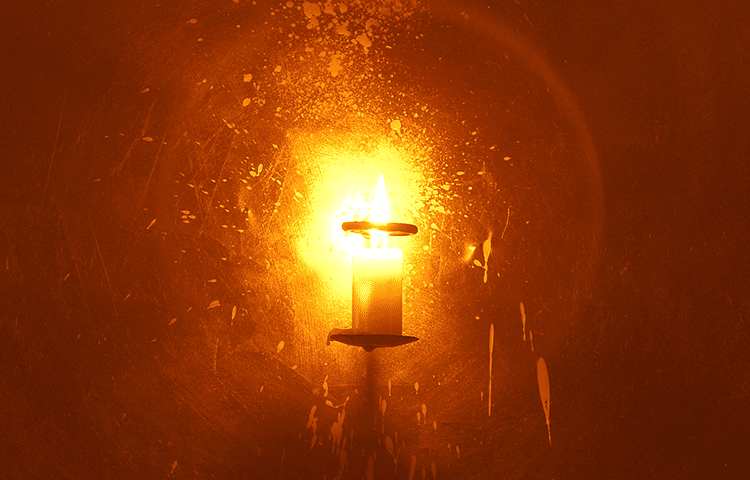
At what (x,y) coordinates should I click in order to perform the action: click on bright yellow light. Please return your answer as a coordinate pair (x, y). Looking at the image, I should click on (342, 215).